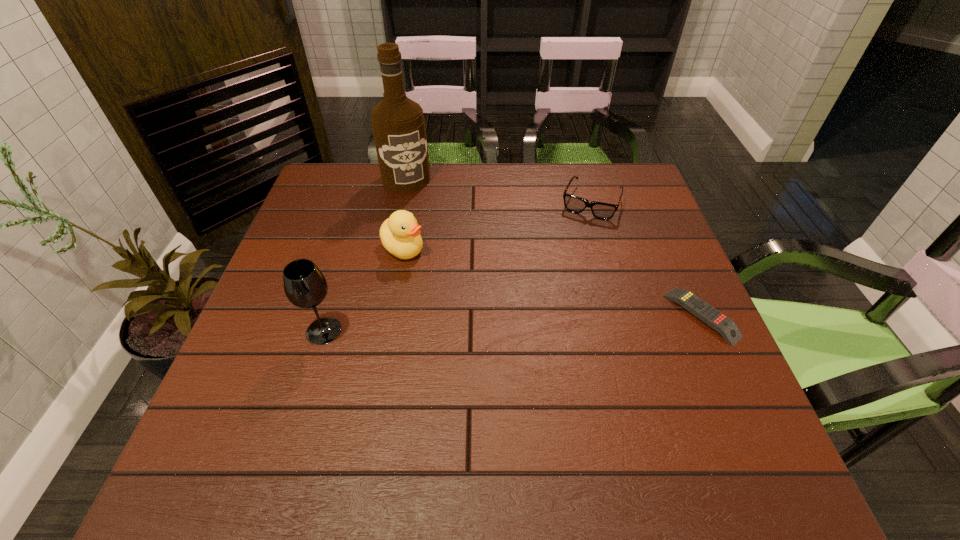
Locate an element on the screen. the second tallest object is located at coordinates (305, 286).

This screenshot has height=540, width=960. In order to click on remote control in this screenshot , I will do `click(705, 312)`.

This screenshot has width=960, height=540. I want to click on the shortest object, so click(705, 312).

Where is `the third farthest object`? The width and height of the screenshot is (960, 540). the third farthest object is located at coordinates (400, 235).

Find the location of a particular element. duck is located at coordinates (400, 235).

Where is `the tallest object`? the tallest object is located at coordinates (398, 125).

The height and width of the screenshot is (540, 960). Find the location of `the fourth tallest object`. the fourth tallest object is located at coordinates (604, 211).

Find the location of a particular element. This screenshot has height=540, width=960. sunglasses is located at coordinates (604, 211).

Where is `free region located 0.060m on the front of the second tallest object`? This screenshot has height=540, width=960. free region located 0.060m on the front of the second tallest object is located at coordinates (x=312, y=370).

The width and height of the screenshot is (960, 540). I want to click on vacant position located on the front of the remote control, so click(x=742, y=407).